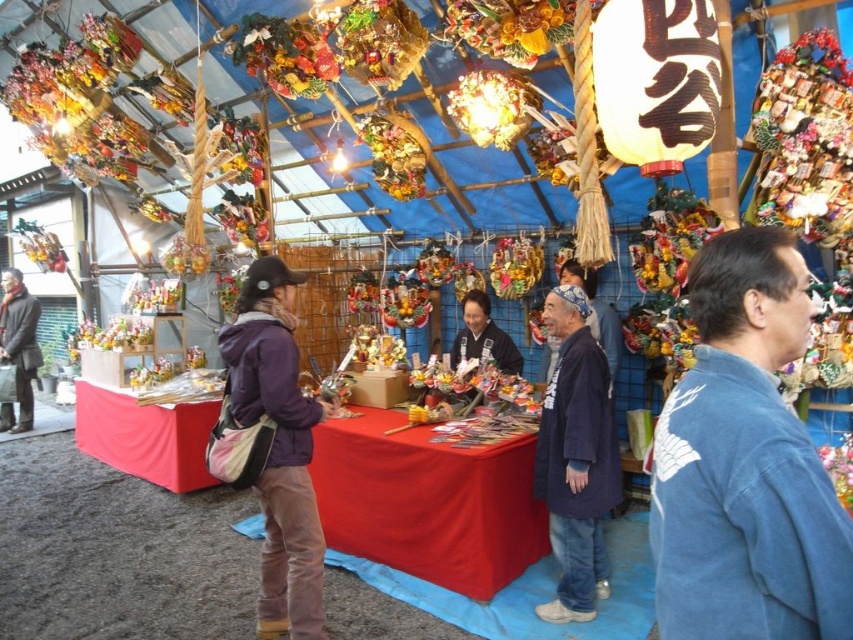
Question: Is the position of blue denim jacket at lower right less distant than that of dark blue fabric at center?

Choices:
 (A) no
 (B) yes

Answer: (B)

Question: Is purple fleece jacket at center wider than dark gray wool coat at left?

Choices:
 (A) no
 (B) yes

Answer: (A)

Question: Is blue denim jacket at lower right smaller than purple fleece jacket at center?

Choices:
 (A) yes
 (B) no

Answer: (A)

Question: Which object appears closest to the camera in this image?

Choices:
 (A) dark blue fabric at center
 (B) blue denim jacket at lower right
 (C) dark gray wool coat at left
 (D) blue cotton kimono at center

Answer: (B)

Question: Which point appears closest to the camera in this image?

Choices:
 (A) (598, 381)
 (B) (15, 388)
 (C) (473, 330)

Answer: (A)

Question: Which of the following is the farthest from the observer?

Choices:
 (A) (488, 355)
 (B) (228, 349)

Answer: (A)